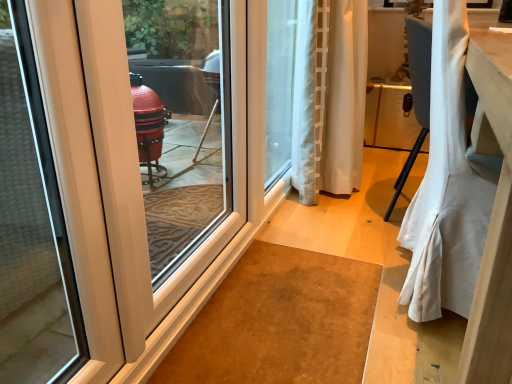
Question: Is white glossy door at left positioned behind white sheer curtain at center, marked as the first curtain in a back-to-front arrangement?

Choices:
 (A) no
 (B) yes

Answer: (A)

Question: Does white glossy door at left have a greater width compared to white sheer curtain at center, marked as the first curtain in a back-to-front arrangement?

Choices:
 (A) no
 (B) yes

Answer: (A)

Question: Is white glossy door at left located outside white sheer curtain at center, marked as the first curtain in a back-to-front arrangement?

Choices:
 (A) yes
 (B) no

Answer: (A)

Question: Is the depth of white glossy door at left less than that of white sheer curtain at center, which is counted as the 2th curtain, starting from the front?

Choices:
 (A) no
 (B) yes

Answer: (B)

Question: From the image's perspective, is white glossy door at left on top of white sheer curtain at center, marked as the first curtain in a back-to-front arrangement?

Choices:
 (A) no
 (B) yes

Answer: (A)

Question: Is white sheer curtain at center, which is counted as the 2th curtain, starting from the front, completely or partially inside white glossy door at left?

Choices:
 (A) yes
 (B) no

Answer: (B)

Question: Is carpet at center facing away from white glossy door at left?

Choices:
 (A) no
 (B) yes

Answer: (A)

Question: Is carpet at center far away from white glossy door at left?

Choices:
 (A) yes
 (B) no

Answer: (B)

Question: From the image's perspective, is carpet at center above white glossy door at left?

Choices:
 (A) no
 (B) yes

Answer: (A)

Question: Would you say white glossy door at left is part of carpet at center's contents?

Choices:
 (A) yes
 (B) no

Answer: (B)

Question: Can you confirm if carpet at center is thinner than white glossy door at left?

Choices:
 (A) yes
 (B) no

Answer: (B)

Question: Considering the relative sizes of carpet at center and white glossy door at left in the image provided, is carpet at center shorter than white glossy door at left?

Choices:
 (A) no
 (B) yes

Answer: (B)

Question: Considering the relative positions of white fabric curtain at right, which ranks as the 1th curtain in front-to-back order, and white sheer curtain at center, marked as the first curtain in a back-to-front arrangement, in the image provided, is white fabric curtain at right, which ranks as the 1th curtain in front-to-back order, to the right of white sheer curtain at center, marked as the first curtain in a back-to-front arrangement, from the viewer's perspective?

Choices:
 (A) no
 (B) yes

Answer: (B)